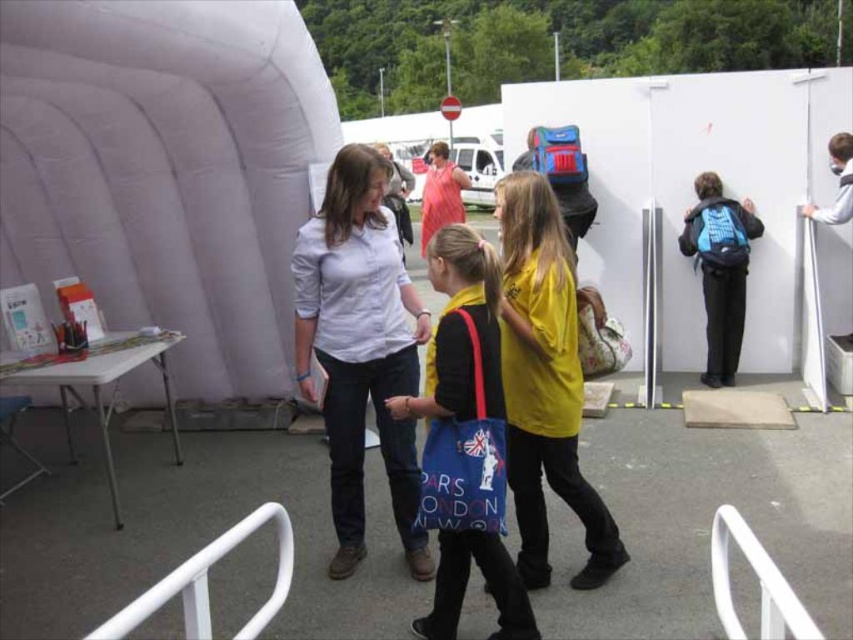
Who is positioned more to the right, white cotton shirt at center or matte pink shirt at center?

From the viewer's perspective, matte pink shirt at center appears more on the right side.

Who is more forward, (328,182) or (428,182)?

Point (328,182)

The width and height of the screenshot is (853, 640). I want to click on white cotton shirt at center, so click(x=360, y=348).

What are the coordinates of `blue fabric bag at center` in the screenshot? It's located at (460, 332).

Which is below, blue fabric bag at center or matte pink shirt at center?

blue fabric bag at center is lower down.

Is point (451, 241) more distant than point (430, 227)?

No, it is not.

Where is `blue fabric bag at center`? The height and width of the screenshot is (640, 853). blue fabric bag at center is located at coordinates (460, 332).

Who is shorter, white cotton shirt at center or yellow matte shirt at center?

yellow matte shirt at center is shorter.

Is white cotton shirt at center taller than yellow matte shirt at center?

Indeed, white cotton shirt at center has a greater height compared to yellow matte shirt at center.

Between point (341, 388) and point (537, 193), which one is positioned behind?

The point (341, 388) is more distant.

At what (x,y) coordinates should I click in order to perform the action: click on white cotton shirt at center. Please return your answer as a coordinate pair (x, y). Image resolution: width=853 pixels, height=640 pixels. Looking at the image, I should click on (360, 348).